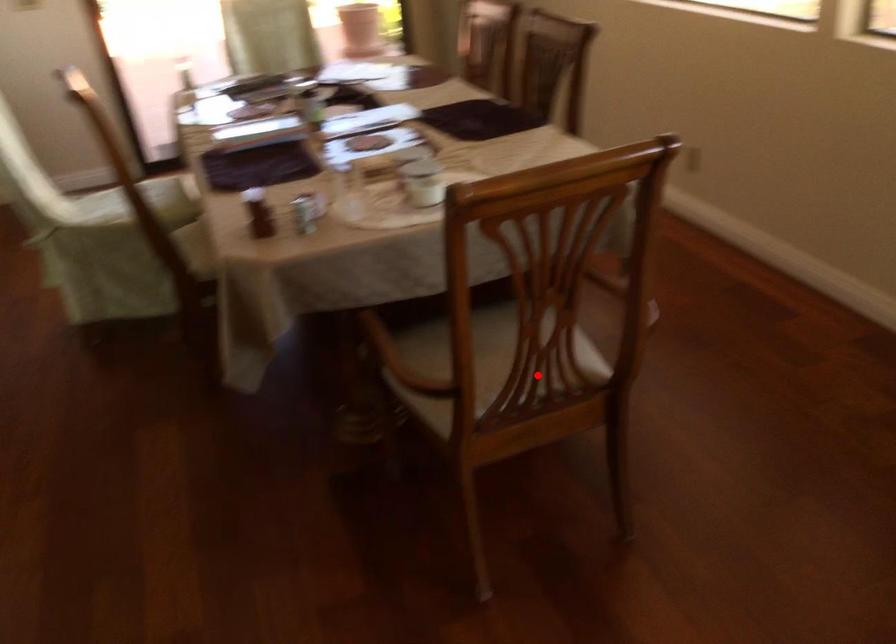
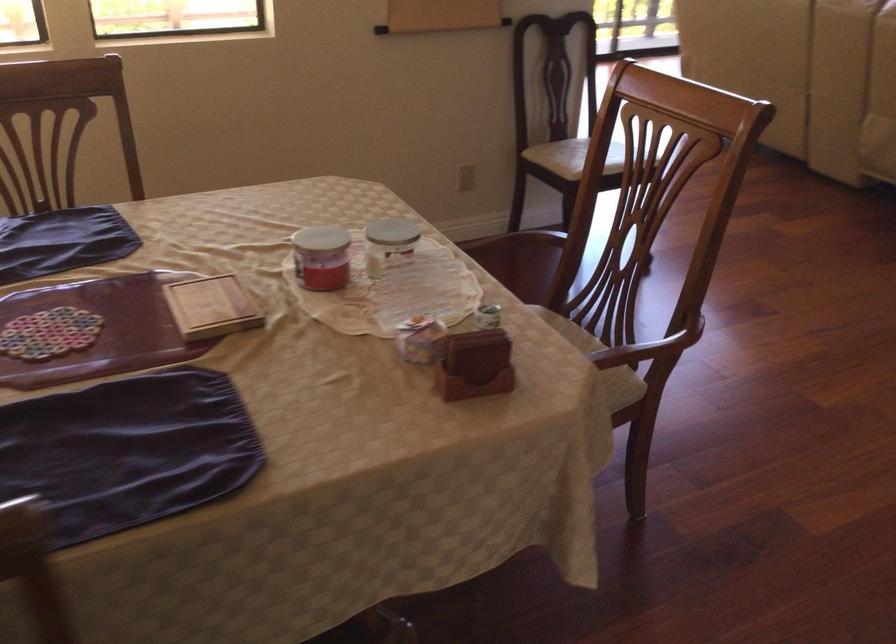
Find the pixel in the second image that matches the highlighted location in the first image.

(564, 322)